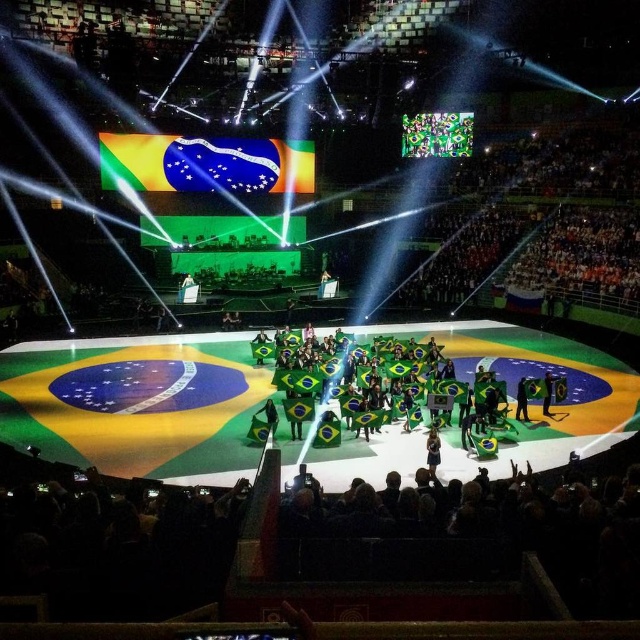
Is point (440, 456) positioned behind point (545, 410)?

That is False.

Between point (433, 435) and point (547, 397), which one is positioned behind?

Positioned behind is point (547, 397).

Image resolution: width=640 pixels, height=640 pixels. What do you see at coordinates (433, 451) in the screenshot?
I see `green fabric person at center` at bounding box center [433, 451].

The image size is (640, 640). I want to click on green fabric person at center, so click(433, 451).